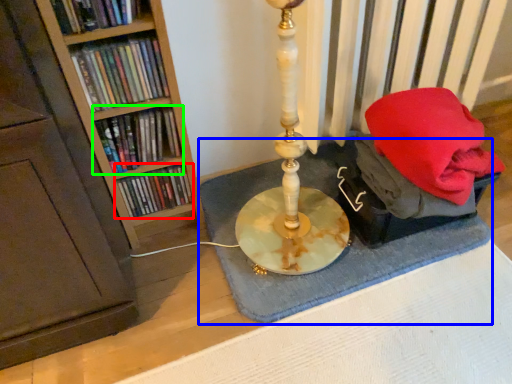
Question: Considering the real-world distances, which object is closest to book (highlighted by a red box)? bath mat (highlighted by a blue box) or book (highlighted by a green box).

Choices:
 (A) bath mat
 (B) book

Answer: (B)